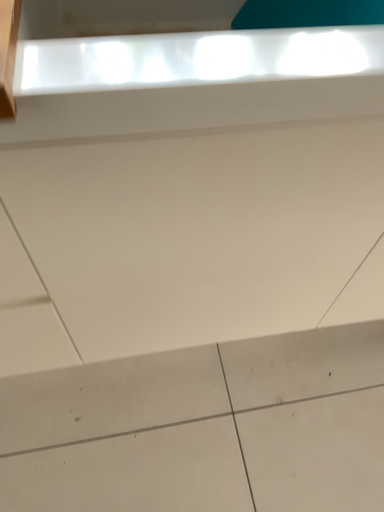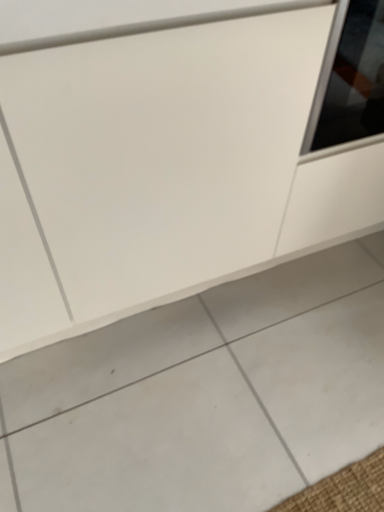
Question: How did the camera likely rotate when shooting the video?

Choices:
 (A) rotated upward
 (B) rotated downward

Answer: (A)